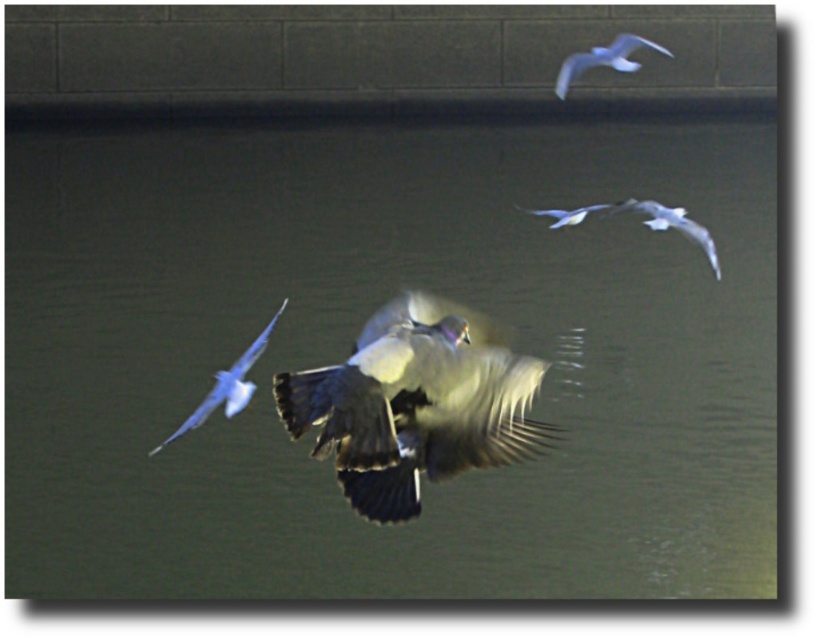
You are standing on the dock and see the point marked at coordinates (351, 346). What is the surface condition of the water at that point?

The point at coordinates (351, 346) is on smooth water at center, so the surface condition is smooth.

You are a birdwatcher standing on the edge of a lake. You see the smooth water at center and the white feathered bird at left. How far apart are these two objects?

The smooth water at center is 9.46 meters from the white feathered bird at left.